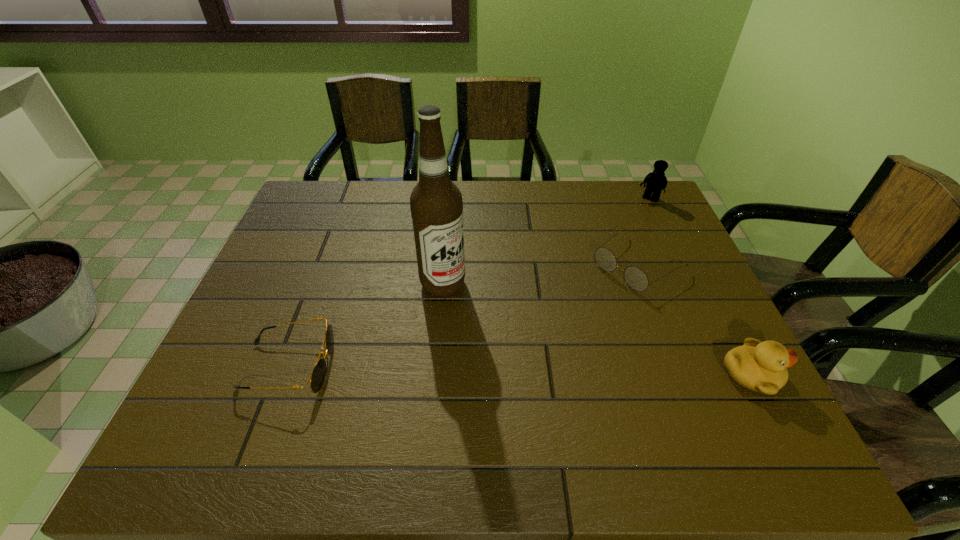
The image size is (960, 540). Identify the location of free spot between the second object from left to right and the leftmost object. (366, 325).

Where is `vacant region between the alcohol and the leftmost object`? The image size is (960, 540). vacant region between the alcohol and the leftmost object is located at coordinates (366, 325).

Locate an element on the screen. blank region between the sunglasses and the second object from left to right is located at coordinates (366, 325).

Image resolution: width=960 pixels, height=540 pixels. What are the coordinates of `empty space between the fourth object from right to left and the spectacles` in the screenshot? It's located at (540, 274).

I want to click on vacant space that is in between the leftmost object and the alcohol, so click(366, 325).

Identify the location of free area in between the spectacles and the sunglasses. (463, 315).

I want to click on empty space that is in between the farthest object and the duckling, so click(x=700, y=287).

Identify the location of vacant space that is in between the third shortest object and the alcohol. (596, 329).

Locate an element on the screen. free space between the sunglasses and the fourth object from right to left is located at coordinates (366, 325).

The image size is (960, 540). I want to click on empty space between the second object from left to right and the spectacles, so click(x=540, y=274).